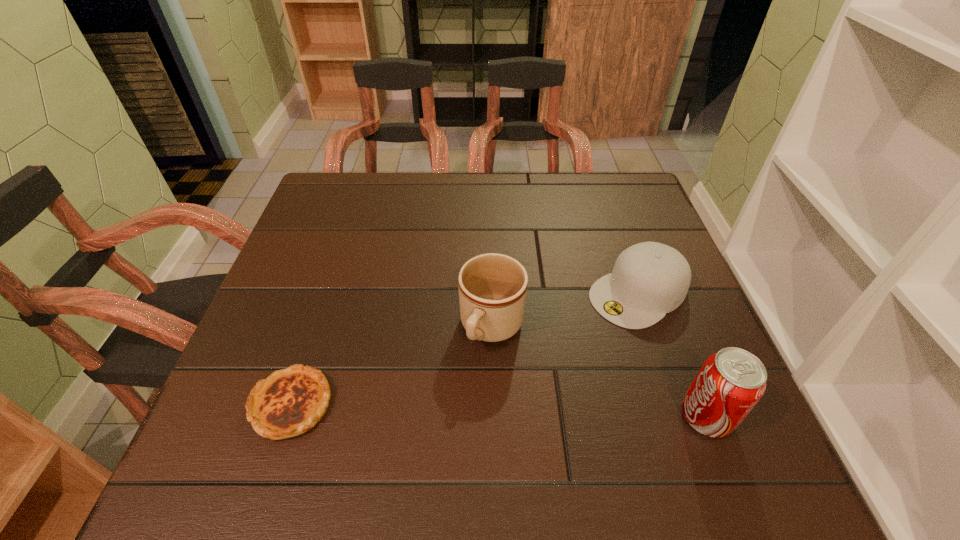
Find the location of a particular element. vacant region at the near edge of the desktop is located at coordinates click(x=465, y=397).

Locate an element on the screen. Image resolution: width=960 pixels, height=540 pixels. free space at the left edge of the desktop is located at coordinates (288, 356).

This screenshot has width=960, height=540. In the image, there is a desktop. What are the coordinates of `vacant space at the right edge` in the screenshot? It's located at (613, 260).

This screenshot has width=960, height=540. I want to click on free space at the far left corner of the desktop, so [x=349, y=172].

Where is `free space at the far right corner of the desktop`? Image resolution: width=960 pixels, height=540 pixels. free space at the far right corner of the desktop is located at coordinates (602, 187).

Find the location of a particular element. Image resolution: width=960 pixels, height=540 pixels. free space at the near right corner of the desktop is located at coordinates (651, 397).

The width and height of the screenshot is (960, 540). I want to click on empty location between the second tallest object and the cap, so click(565, 310).

At what (x,y) coordinates should I click in order to perform the action: click on unoccupied position between the quiche and the second tallest object. Please return your answer as a coordinate pair (x, y). Image resolution: width=960 pixels, height=540 pixels. Looking at the image, I should click on (392, 366).

You are a GUI agent. You are given a task and a screenshot of the screen. Output one action in this format:
    pyautogui.click(x=<x>, y=<y>)
    Task: Click on the unoccupied position between the leftmost object and the soda
    
    Given the screenshot: What is the action you would take?
    pyautogui.click(x=498, y=410)

This screenshot has height=540, width=960. In order to click on unoccupied area between the mug and the cap in this screenshot , I will do (x=565, y=310).